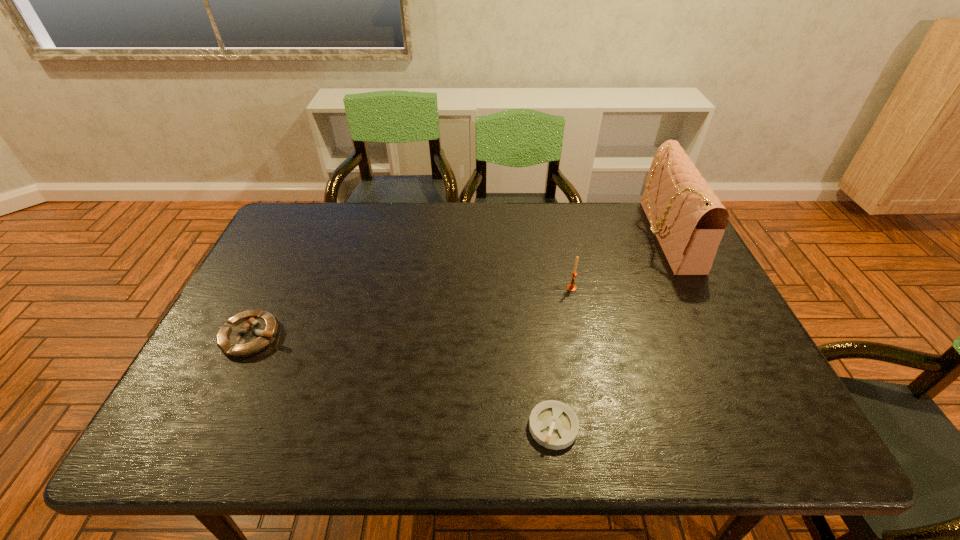
At what (x,y) coordinates should I click in order to perform the action: click on free space at the near edge of the desktop. Please return your answer as a coordinate pair (x, y). This screenshot has height=540, width=960. Looking at the image, I should click on (654, 428).

The height and width of the screenshot is (540, 960). In order to click on blank space at the left edge of the desktop in this screenshot , I will do (x=263, y=298).

Image resolution: width=960 pixels, height=540 pixels. I want to click on vacant space at the right edge of the desktop, so click(x=659, y=255).

Find the location of a particular element. The height and width of the screenshot is (540, 960). vacant space at the far right corner of the desktop is located at coordinates (641, 205).

The width and height of the screenshot is (960, 540). In order to click on free area in between the leftmost object and the rightmost object in this screenshot , I will do `click(459, 286)`.

Identify the location of vacant area that lies between the second object from right to left and the farthest object. This screenshot has width=960, height=540. (618, 262).

Find the location of a particular element. This screenshot has height=540, width=960. empty space that is in between the right ashtray and the left ashtray is located at coordinates (403, 381).

This screenshot has height=540, width=960. What are the coordinates of `free space that is in between the leftmost object and the third object from left to right` in the screenshot? It's located at (412, 312).

Identify the location of free space between the candle_holder and the third farthest object. The image size is (960, 540). (412, 312).

What are the coordinates of `unoccupied position between the shorter ashtray and the handbag` in the screenshot? It's located at (610, 331).